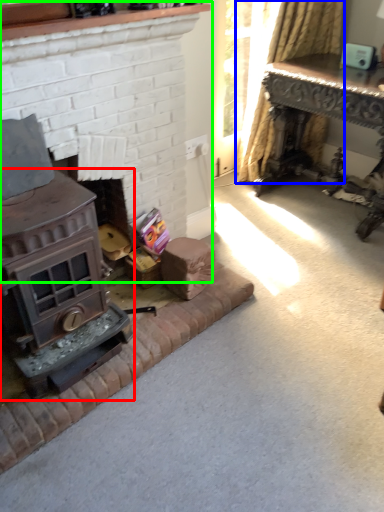
Question: Estimate the real-world distances between objects in this image. Which object is closer to wood burning stove (highlighted by a red box), curtain (highlighted by a blue box) or fireplace (highlighted by a green box)?

Choices:
 (A) curtain
 (B) fireplace

Answer: (B)